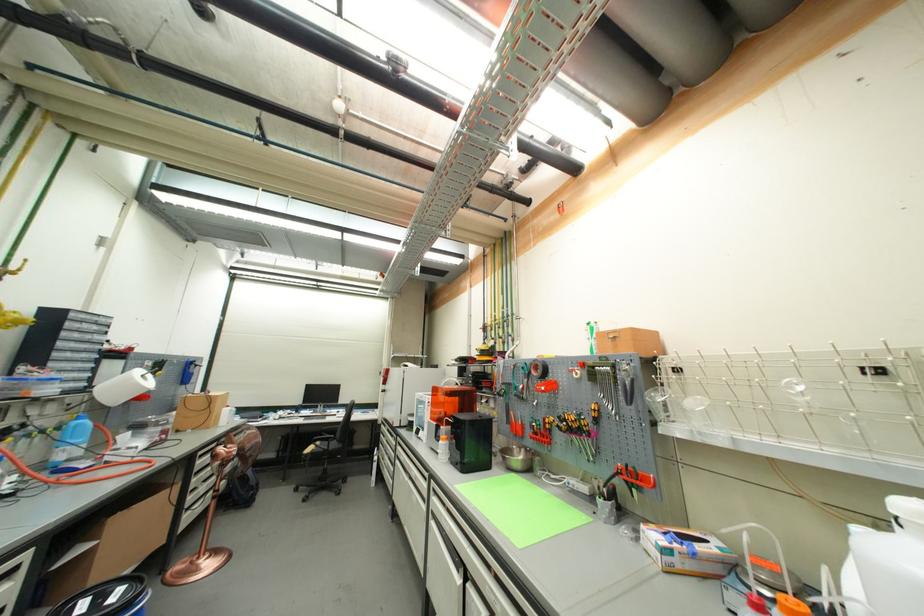
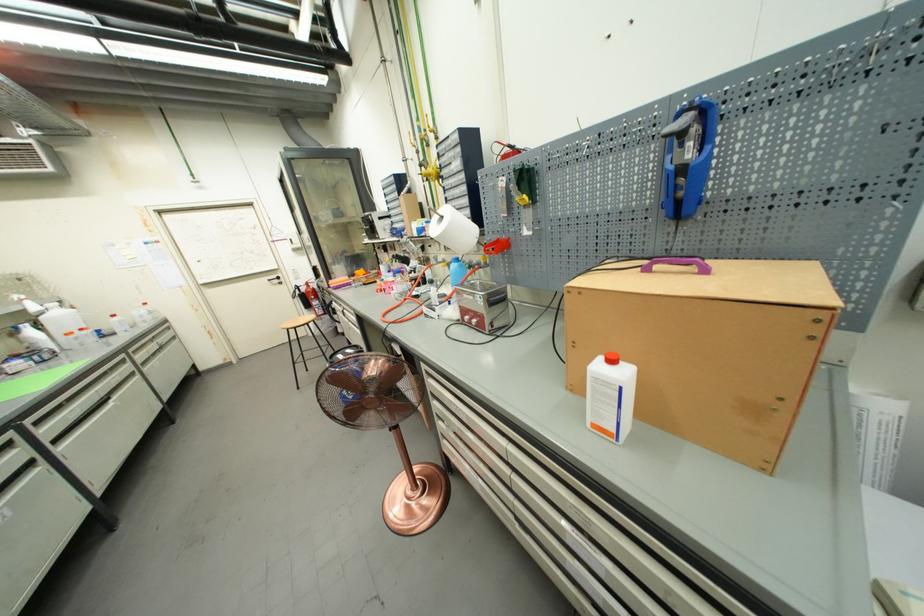
The point at [234,408] is marked in the first image. Where is the corresponding point in the second image?

(617, 363)